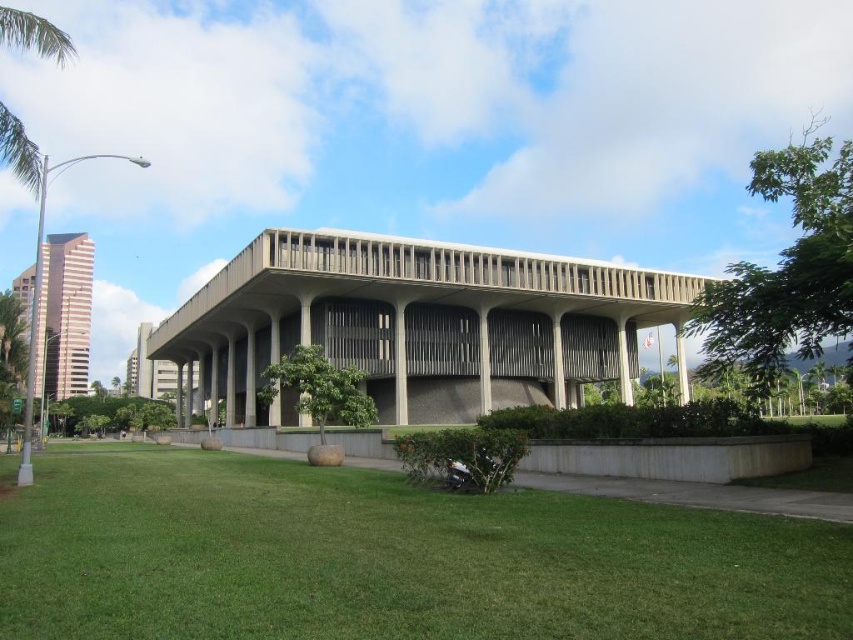
Looking at this image, you are standing in front of the modern building and want to find a spot to place a small bench. The bench needs to be placed where the green grass at center and the green leafy palm tree at upper left are both visible. Based on their positions, where should you place the bench?

The green grass at center is located below the green leafy palm tree at upper left, so placing the bench in the area between them would allow visibility of both the green grass at center and the green leafy palm tree at upper left.